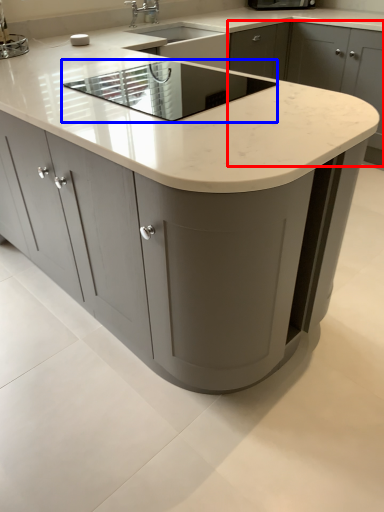
Question: Which of the following is the closest to the observer, cabinetry (highlighted by a red box) or appliance (highlighted by a blue box)?

Choices:
 (A) cabinetry
 (B) appliance

Answer: (B)